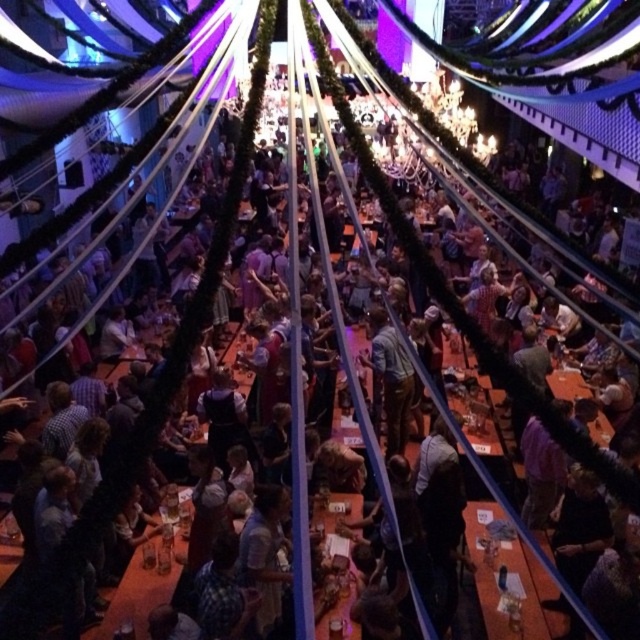
Question: Which point is farther from the camera taking this photo?

Choices:
 (A) [333, 531]
 (B) [513, 636]

Answer: (A)

Question: Can you confirm if wooden table at lower right is smaller than wooden table at center?

Choices:
 (A) yes
 (B) no

Answer: (B)

Question: Is wooden table at lower right below wooden table at center?

Choices:
 (A) no
 (B) yes

Answer: (B)

Question: Which point is farther to the camera?

Choices:
 (A) wooden table at center
 (B) wooden table at lower right

Answer: (A)

Question: Which object is closer to the camera taking this photo?

Choices:
 (A) wooden table at center
 (B) wooden table at lower right

Answer: (B)

Question: From the image, what is the correct spatial relationship of wooden table at lower right in relation to wooden table at center?

Choices:
 (A) below
 (B) above

Answer: (A)